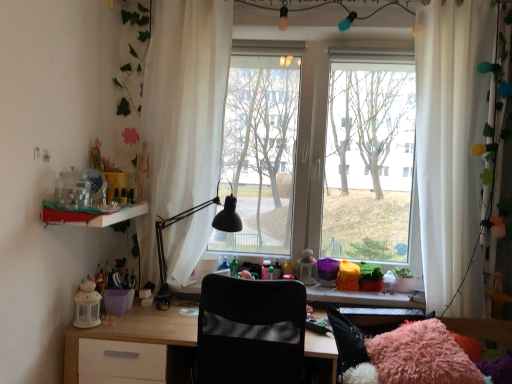
Question: Is light wood desk at center far from transparent glass window at center?

Choices:
 (A) no
 (B) yes

Answer: (B)

Question: Can transparent glass window at center be found inside light wood desk at center?

Choices:
 (A) yes
 (B) no

Answer: (B)

Question: Is light wood desk at center positioned before transparent glass window at center?

Choices:
 (A) yes
 (B) no

Answer: (A)

Question: Considering the relative sizes of light wood desk at center and transparent glass window at center in the image provided, is light wood desk at center thinner than transparent glass window at center?

Choices:
 (A) yes
 (B) no

Answer: (B)

Question: From a real-world perspective, is light wood desk at center under transparent glass window at center?

Choices:
 (A) yes
 (B) no

Answer: (A)

Question: Does light wood desk at center have a greater width compared to transparent glass window at center?

Choices:
 (A) no
 (B) yes

Answer: (B)

Question: Is white sheer curtain at center, arranged as the first curtain when viewed from the left, to the left of matte plastic shelf at left from the viewer's perspective?

Choices:
 (A) yes
 (B) no

Answer: (B)

Question: Does white sheer curtain at center, arranged as the first curtain when viewed from the left, have a greater width compared to matte plastic shelf at left?

Choices:
 (A) yes
 (B) no

Answer: (B)

Question: Is white sheer curtain at center, acting as the second curtain starting from the right, oriented away from matte plastic shelf at left?

Choices:
 (A) no
 (B) yes

Answer: (A)

Question: Is white sheer curtain at center, arranged as the first curtain when viewed from the left, positioned beyond the bounds of matte plastic shelf at left?

Choices:
 (A) yes
 (B) no

Answer: (A)

Question: Considering the relative sizes of white sheer curtain at center, acting as the second curtain starting from the right, and matte plastic shelf at left in the image provided, is white sheer curtain at center, acting as the second curtain starting from the right, bigger than matte plastic shelf at left?

Choices:
 (A) yes
 (B) no

Answer: (A)

Question: From a real-world perspective, is matte plastic shelf at left positioned under white sheer curtain at right, the 2th curtain when ordered from left to right, based on gravity?

Choices:
 (A) no
 (B) yes

Answer: (B)